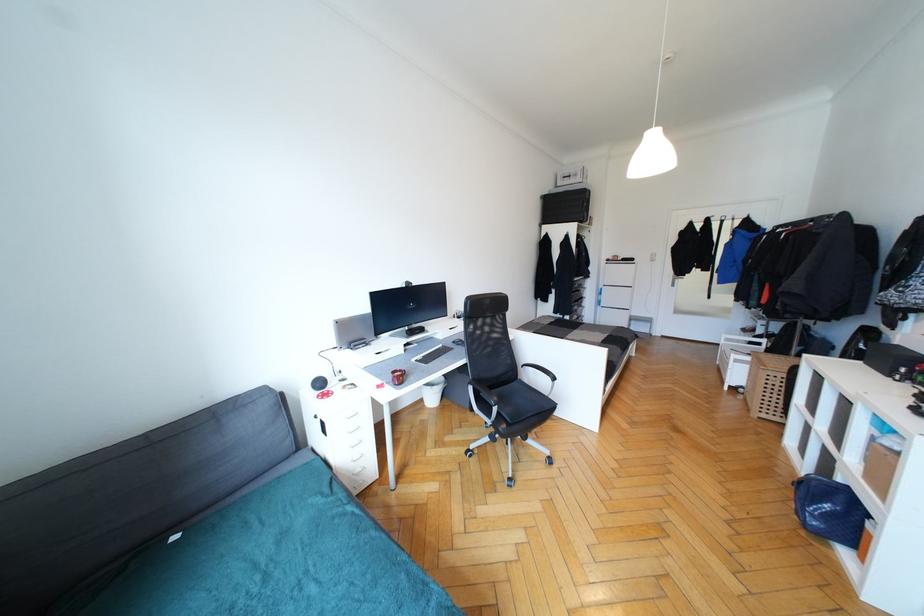
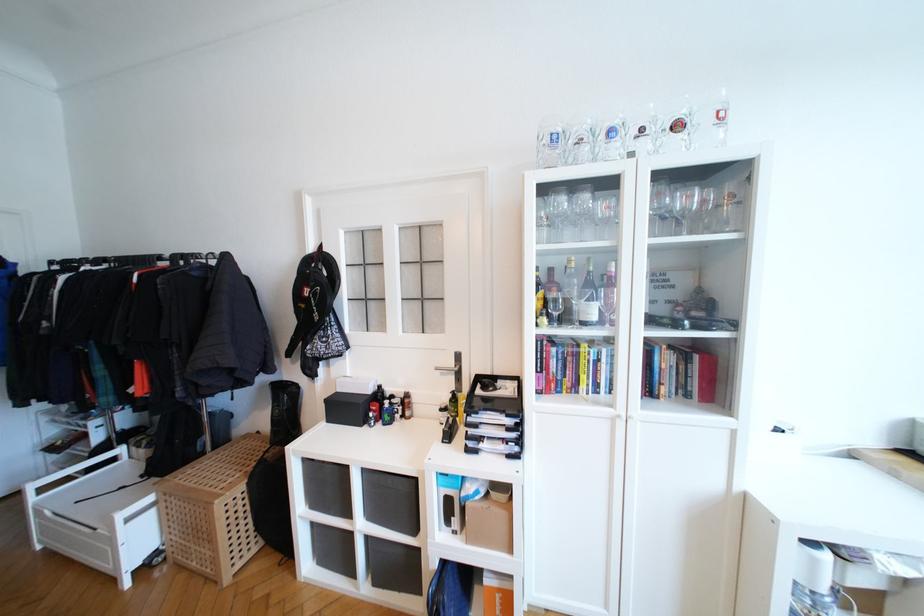
Where in the second image is the point corresponding to point (774, 413) from the first image?

(248, 551)